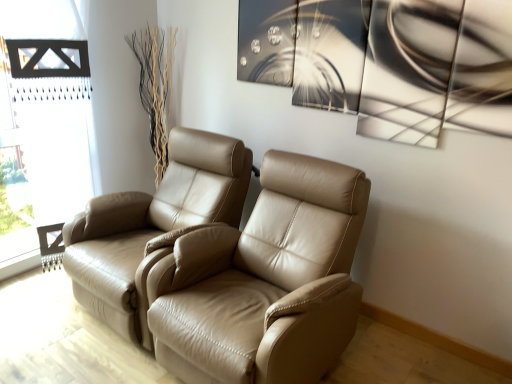
At what (x,y) coordinates should I click in order to perform the action: click on tan leather recliner at center, acting as the 2th chair starting from the left. Please return your answer as a coordinate pair (x, y). The width and height of the screenshot is (512, 384). Looking at the image, I should click on (265, 281).

In order to face black wooden frame at left, should I rotate leftwards or rightwards?

To align with it, rotate left about 28.683°.

Find the location of `tan leather recliner at center, acting as the 2th chair starting from the left`. tan leather recliner at center, acting as the 2th chair starting from the left is located at coordinates (265, 281).

Which is in front, point (89, 96) or point (346, 274)?

Point (346, 274)

Based on their sizes in the image, would you say black wooden frame at left is bigger or smaller than tan leather recliner at center, acting as the 2th chair starting from the left?

In the image, black wooden frame at left appears to be smaller than tan leather recliner at center, acting as the 2th chair starting from the left.

Is black wooden frame at left located outside tan leather recliner at center, acting as the 2th chair starting from the left?

Yes, black wooden frame at left is not within tan leather recliner at center, acting as the 2th chair starting from the left.

Does black wooden frame at left lie in front of tan leather recliner at center, acting as the 2th chair starting from the left?

No, black wooden frame at left is further to the viewer.

Looking at this image, can you confirm if tan leather recliner at center, acting as the 2th chair starting from the left, is taller than black wooden frame at left?

In fact, tan leather recliner at center, acting as the 2th chair starting from the left, may be shorter than black wooden frame at left.

Is tan leather recliner at center, the first chair positioned from the right, bigger or smaller than black wooden frame at left?

Considering their sizes, tan leather recliner at center, the first chair positioned from the right, takes up more space than black wooden frame at left.

What's the angular difference between tan leather recliner at center, the first chair positioned from the right, and black wooden frame at left's facing directions?

tan leather recliner at center, the first chair positioned from the right, and black wooden frame at left are facing 90.2 degrees away from each other.

Is tan leather chair at left, the first chair in the left-to-right sequence, not inside black wooden frame at left?

tan leather chair at left, the first chair in the left-to-right sequence, is positioned outside black wooden frame at left.

Based on the photo, considering the relative sizes of tan leather chair at left, arranged as the second chair when viewed from the right, and black wooden frame at left in the image provided, is tan leather chair at left, arranged as the second chair when viewed from the right, taller than black wooden frame at left?

No.

Which object is positioned more to the left, tan leather chair at left, the first chair in the left-to-right sequence, or black wooden frame at left?

black wooden frame at left.

How different are the orientations of black wooden frame at left and tan leather chair at left, arranged as the second chair when viewed from the right, in degrees?

90.2 degrees.

Starting from the black wooden frame at left, which chair is the 1st one in front? Please provide its 2D coordinates.

[(152, 225)]

From a real-world perspective, which is physically above, black wooden frame at left or tan leather chair at left, arranged as the second chair when viewed from the right?

From a 3D spatial view, black wooden frame at left is above.

Is tan leather chair at left, arranged as the second chair when viewed from the right, located within black wooden frame at left?

No, tan leather chair at left, arranged as the second chair when viewed from the right, is not a part of black wooden frame at left.

Is tan leather recliner at center, the first chair positioned from the right, positioned beyond the bounds of tan leather chair at left, arranged as the second chair when viewed from the right?

That's correct, tan leather recliner at center, the first chair positioned from the right, is outside of tan leather chair at left, arranged as the second chair when viewed from the right.

Find the location of a particular element. The image size is (512, 384). chair positioned vertically above the tan leather recliner at center, the first chair positioned from the right (from a real-world perspective) is located at coordinates (152, 225).

Between tan leather recliner at center, the first chair positioned from the right, and tan leather chair at left, the first chair in the left-to-right sequence, which one has smaller width?

With smaller width is tan leather chair at left, the first chair in the left-to-right sequence.

Is point (328, 290) in front of point (185, 147)?

Yes, point (328, 290) is in front of point (185, 147).

Does tan leather chair at left, the first chair in the left-to-right sequence, have a greater width compared to tan leather recliner at center, the first chair positioned from the right?

Incorrect, the width of tan leather chair at left, the first chair in the left-to-right sequence, does not surpass that of tan leather recliner at center, the first chair positioned from the right.

Which of these two, tan leather chair at left, the first chair in the left-to-right sequence, or tan leather recliner at center, acting as the 2th chair starting from the left, stands taller?

With more height is tan leather recliner at center, acting as the 2th chair starting from the left.

Locate an element on the screen. This screenshot has width=512, height=384. chair above the tan leather recliner at center, acting as the 2th chair starting from the left (from a real-world perspective) is located at coordinates (152, 225).

The height and width of the screenshot is (384, 512). Identify the location of chair that is the 2nd one when counting forward from the black wooden frame at left. (265, 281).

Locate an element on the screen. Image resolution: width=512 pixels, height=384 pixels. window frame behind the tan leather recliner at center, the first chair positioned from the right is located at coordinates (42, 125).

Based on the photo, when comparing their distances from tan leather chair at left, arranged as the second chair when viewed from the right, does black wooden frame at left or tan leather recliner at center, acting as the 2th chair starting from the left, seem closer?

Among the two, tan leather recliner at center, acting as the 2th chair starting from the left, is located nearer to tan leather chair at left, arranged as the second chair when viewed from the right.

Based on their spatial positions, is tan leather chair at left, arranged as the second chair when viewed from the right, or black wooden frame at left further from tan leather recliner at center, acting as the 2th chair starting from the left?

Among the two, black wooden frame at left is located further to tan leather recliner at center, acting as the 2th chair starting from the left.

Looking at the image, which one is located closer to black wooden frame at left, tan leather recliner at center, acting as the 2th chair starting from the left, or tan leather chair at left, arranged as the second chair when viewed from the right?

tan leather chair at left, arranged as the second chair when viewed from the right, is closer to black wooden frame at left.

Considering their positions, is tan leather chair at left, arranged as the second chair when viewed from the right, positioned further to black wooden frame at left than tan leather recliner at center, acting as the 2th chair starting from the left?

tan leather recliner at center, acting as the 2th chair starting from the left.

Based on their spatial positions, is black wooden frame at left or tan leather chair at left, the first chair in the left-to-right sequence, closer to tan leather recliner at center, the first chair positioned from the right?

The object closer to tan leather recliner at center, the first chair positioned from the right, is tan leather chair at left, the first chair in the left-to-right sequence.

Which object lies nearer to the anchor point tan leather chair at left, the first chair in the left-to-right sequence, tan leather recliner at center, acting as the 2th chair starting from the left, or black wooden frame at left?

The object closer to tan leather chair at left, the first chair in the left-to-right sequence, is tan leather recliner at center, acting as the 2th chair starting from the left.

Find the location of a particular element. The height and width of the screenshot is (384, 512). chair between black wooden frame at left and tan leather recliner at center, the first chair positioned from the right, in the horizontal direction is located at coordinates (152, 225).